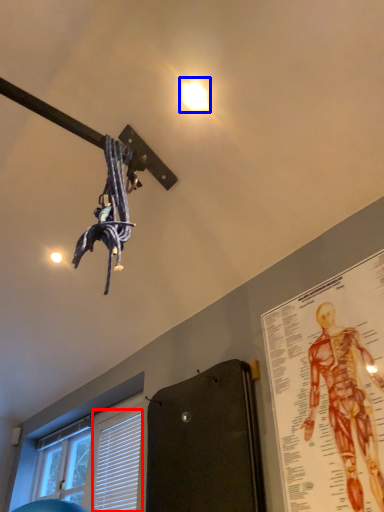
Question: Among these objects, which one is nearest to the camera, blind (highlighted by a red box) or droplight (highlighted by a blue box)?

Choices:
 (A) blind
 (B) droplight

Answer: (B)